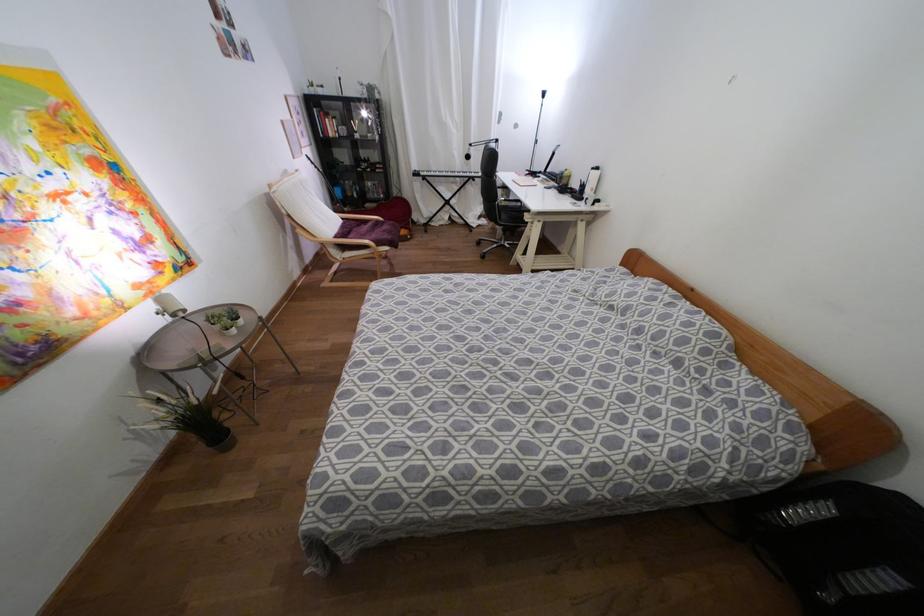
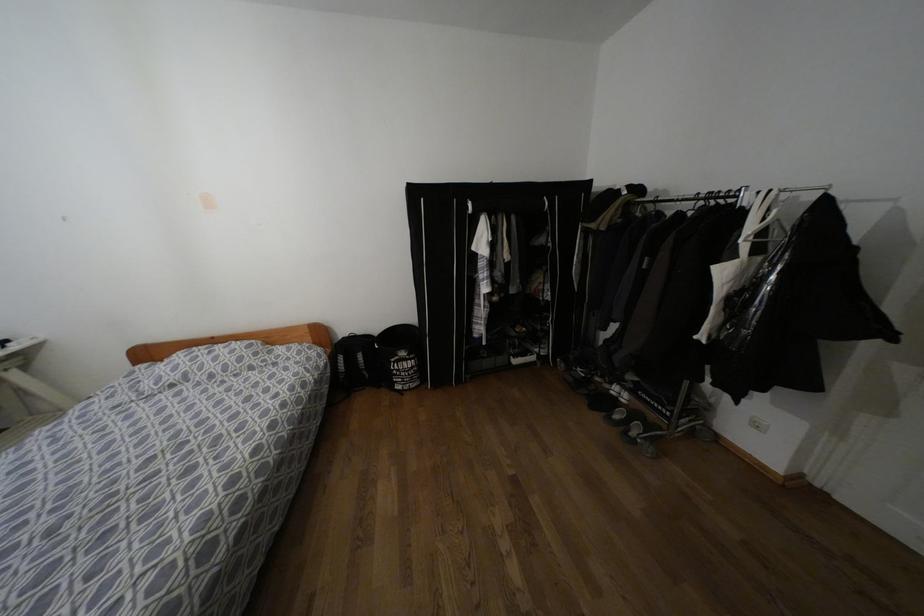
First-person continuous shooting, in which direction is the camera rotating?

The rotation direction of the camera is right-down.